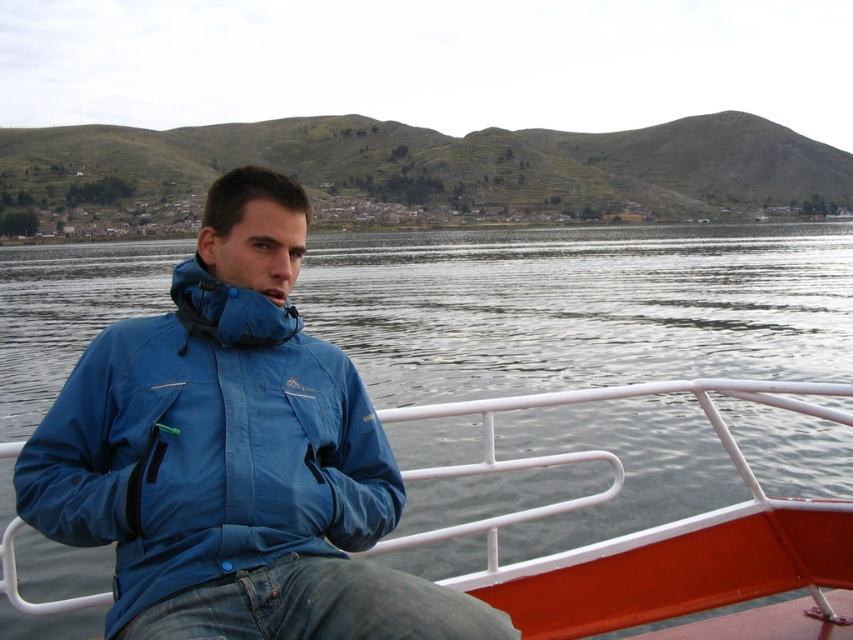
Question: In this image, where is blue waterproof jacket at center located relative to blue fabric boat at center?

Choices:
 (A) left
 (B) right

Answer: (A)

Question: Is blue waterproof jacket at center to the left of blue fabric boat at center from the viewer's perspective?

Choices:
 (A) yes
 (B) no

Answer: (A)

Question: Can you confirm if blue waterproof jacket at center is bigger than blue fabric boat at center?

Choices:
 (A) no
 (B) yes

Answer: (A)

Question: Which of the following is the closest to the observer?

Choices:
 (A) (358, 481)
 (B) (813, 502)

Answer: (A)